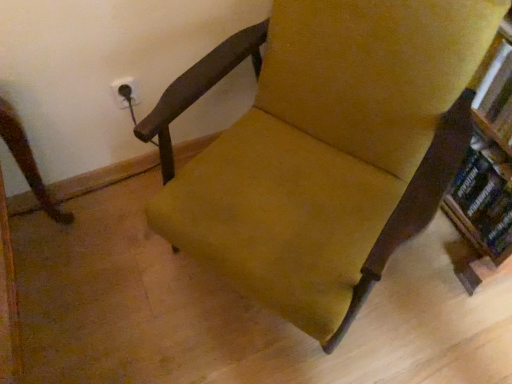
Question: Considering the relative sizes of velvet yellow chair at center and hardcover book at right in the image provided, is velvet yellow chair at center taller than hardcover book at right?

Choices:
 (A) yes
 (B) no

Answer: (A)

Question: Does velvet yellow chair at center turn towards hardcover book at right?

Choices:
 (A) no
 (B) yes

Answer: (A)

Question: Considering the relative positions of velvet yellow chair at center and hardcover book at right in the image provided, is velvet yellow chair at center to the right of hardcover book at right from the viewer's perspective?

Choices:
 (A) yes
 (B) no

Answer: (B)

Question: From the image's perspective, is velvet yellow chair at center over hardcover book at right?

Choices:
 (A) no
 (B) yes

Answer: (B)

Question: From the image's perspective, does velvet yellow chair at center appear lower than hardcover book at right?

Choices:
 (A) yes
 (B) no

Answer: (B)

Question: Would you say velvet yellow chair at center is a long distance from hardcover book at right?

Choices:
 (A) yes
 (B) no

Answer: (B)

Question: Is hardcover book at right wider than velvet yellow chair at center?

Choices:
 (A) yes
 (B) no

Answer: (B)

Question: Is hardcover book at right far from velvet yellow chair at center?

Choices:
 (A) no
 (B) yes

Answer: (A)

Question: Is the position of hardcover book at right more distant than that of velvet yellow chair at center?

Choices:
 (A) no
 (B) yes

Answer: (B)

Question: Does hardcover book at right have a lesser width compared to velvet yellow chair at center?

Choices:
 (A) no
 (B) yes

Answer: (B)

Question: Is hardcover book at right at the left side of velvet yellow chair at center?

Choices:
 (A) yes
 (B) no

Answer: (B)

Question: Is hardcover book at right positioned with its back to velvet yellow chair at center?

Choices:
 (A) yes
 (B) no

Answer: (B)

Question: Looking at the image, does hardcover book at right seem bigger or smaller compared to velvet yellow chair at center?

Choices:
 (A) big
 (B) small

Answer: (B)